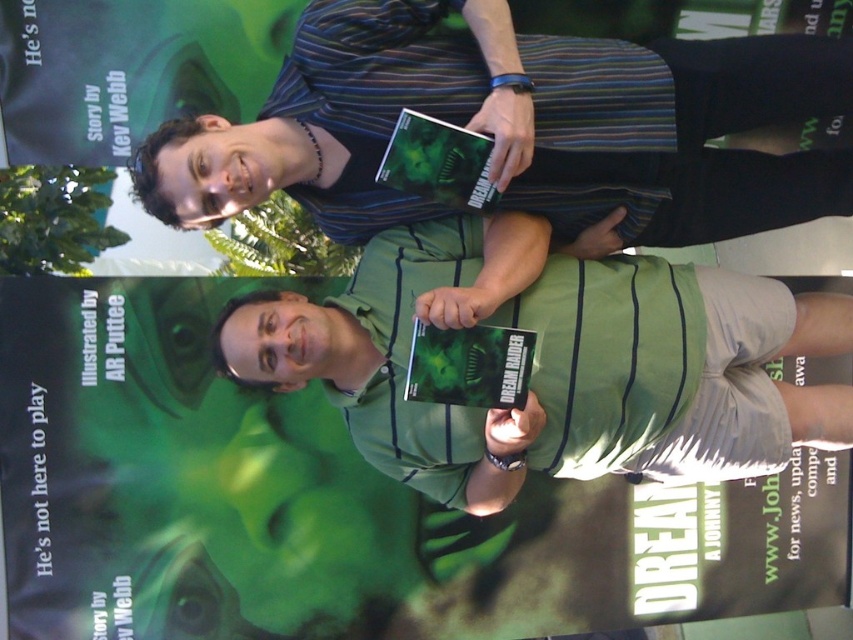
You are standing in front of the book poster and see the point marked at coordinates [517,125]. What object is located at that point?

The point at coordinates [517,125] is located on the green striped shirt at upper center.

Looking at this image, you are a photographer trying to capture both the green striped shirt at upper center and the green striped shirt at center in a single frame. Which shirt should you adjust your camera angle to focus on first to ensure both are in the frame?

The green striped shirt at upper center is to the left of the green striped shirt at center. To capture both in a single frame, adjust your camera angle to focus on the green striped shirt at upper center first, then pan to the right to include the green striped shirt at center.